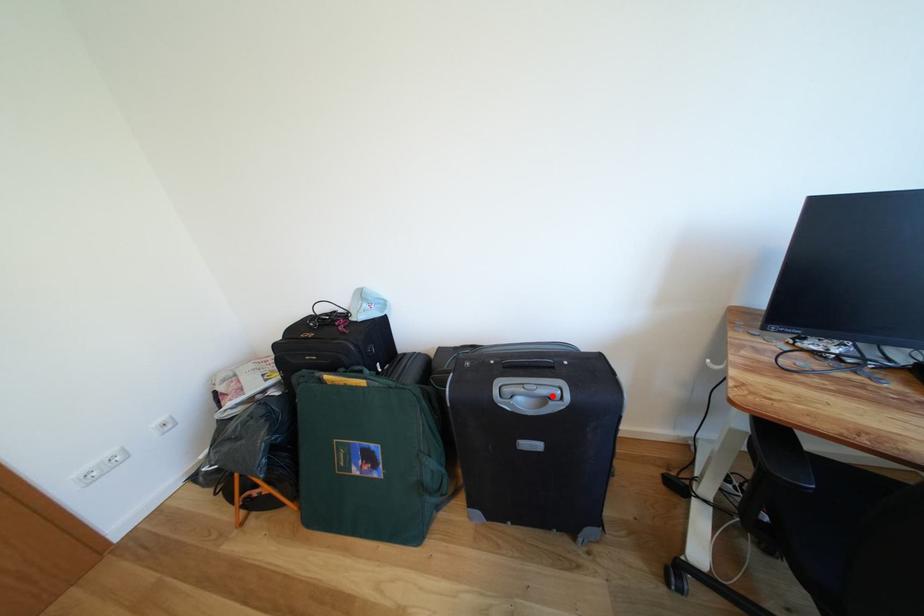
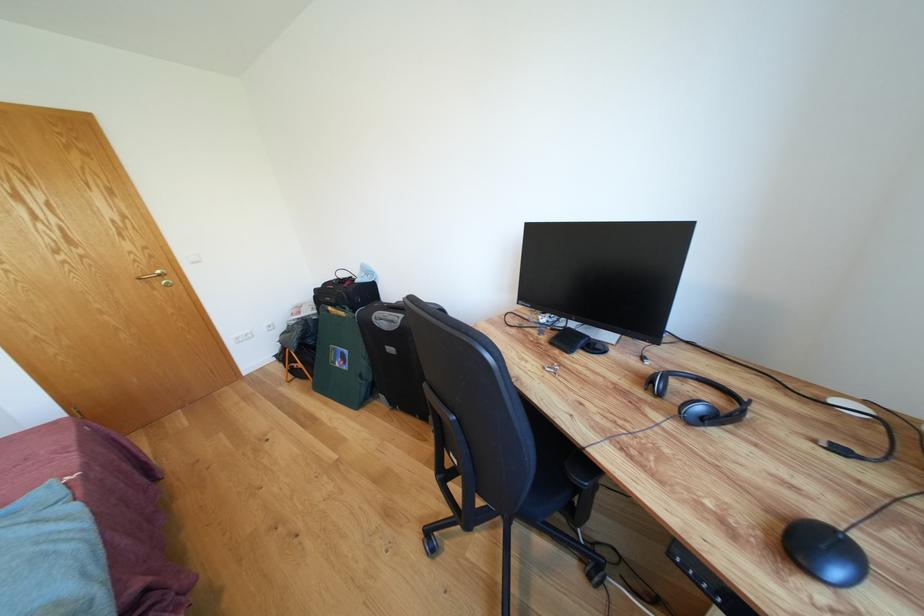
In the second image, find the point that corresponds to the highlighted location in the first image.

(398, 322)